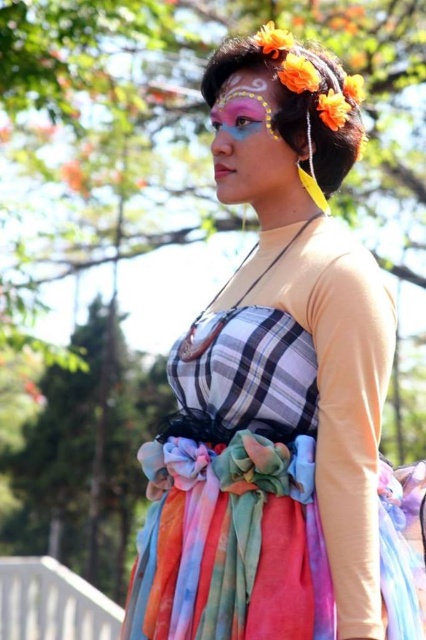
Question: Which point is farther to the camera?

Choices:
 (A) (180, 579)
 (B) (226, 83)

Answer: (B)

Question: Is multicolored fabric dress at center to the right of matte colorful face at center from the viewer's perspective?

Choices:
 (A) yes
 (B) no

Answer: (A)

Question: Can you confirm if multicolored fabric dress at center is positioned above matte colorful face at center?

Choices:
 (A) no
 (B) yes

Answer: (A)

Question: Does multicolored fabric dress at center appear on the right side of matte colorful face at center?

Choices:
 (A) no
 (B) yes

Answer: (B)